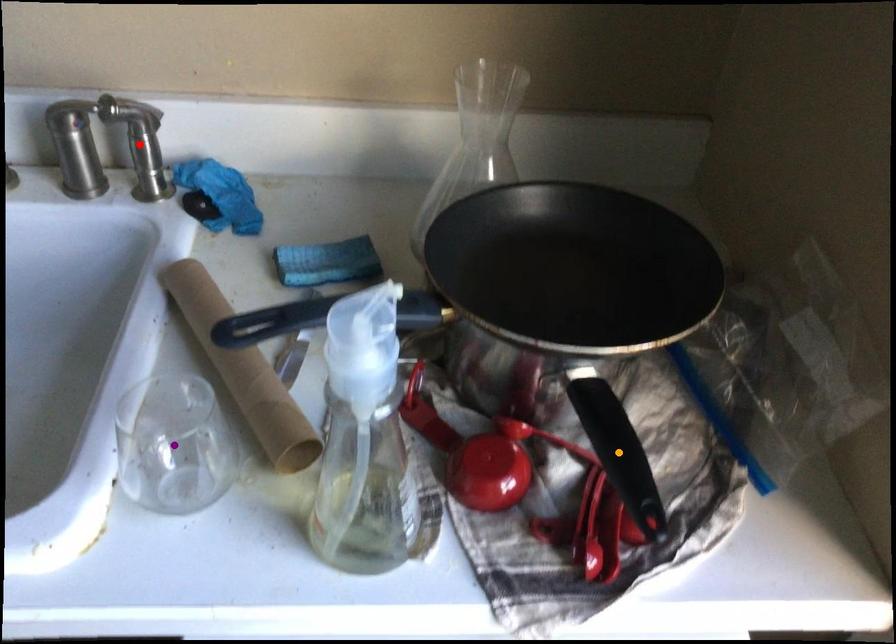
Order these from farthest to nearest:
red point, orange point, purple point

red point
purple point
orange point